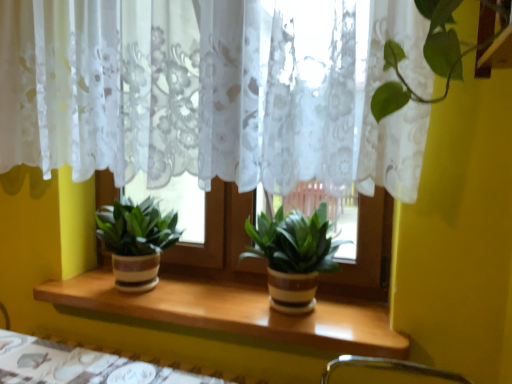
Locate an element on the screen. The height and width of the screenshot is (384, 512). vacant area situated to the left side of green matte plant at center, which is counted as the first houseplant, starting from the left is located at coordinates (79, 279).